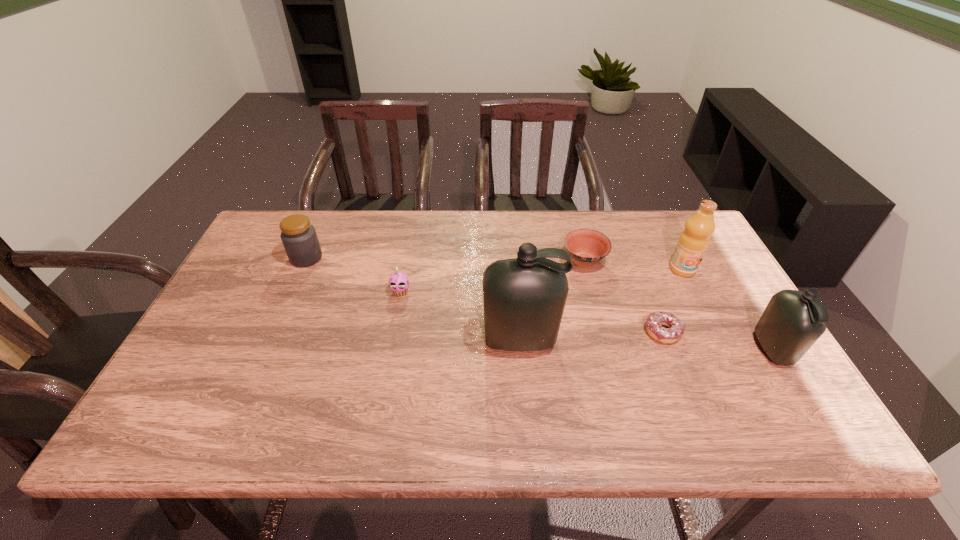
In order to click on free region at the left edge of the desktop in this screenshot , I will do `click(268, 309)`.

At what (x,y) coordinates should I click in order to perform the action: click on vacant region at the right edge of the desktop. Please return your answer as a coordinate pair (x, y). This screenshot has height=540, width=960. Looking at the image, I should click on (725, 354).

In the image, there is a desktop. Where is `vacant space at the far right corner`? The width and height of the screenshot is (960, 540). vacant space at the far right corner is located at coordinates (666, 232).

Find the location of `vacant area that lies between the rightmost object and the third object from right to left`. vacant area that lies between the rightmost object and the third object from right to left is located at coordinates (718, 341).

Identify the location of free spot between the doughnut and the second object from right to left. This screenshot has height=540, width=960. (673, 301).

Locate an element on the screen. The image size is (960, 540). free space between the left bottle and the fourth shortest object is located at coordinates (413, 299).

What are the coordinates of `free space between the shorter bottle and the shortest object` in the screenshot? It's located at (718, 341).

Identify the location of free space between the fourth object from left to right and the third object from right to left. The height and width of the screenshot is (540, 960). (623, 296).

This screenshot has width=960, height=540. I want to click on free space between the shorter bottle and the left bottle, so click(646, 345).

At what (x,y) coordinates should I click in order to perform the action: click on blank region between the tallest object and the shortest object. Please return your answer as a coordinate pair (x, y). Looking at the image, I should click on (591, 336).